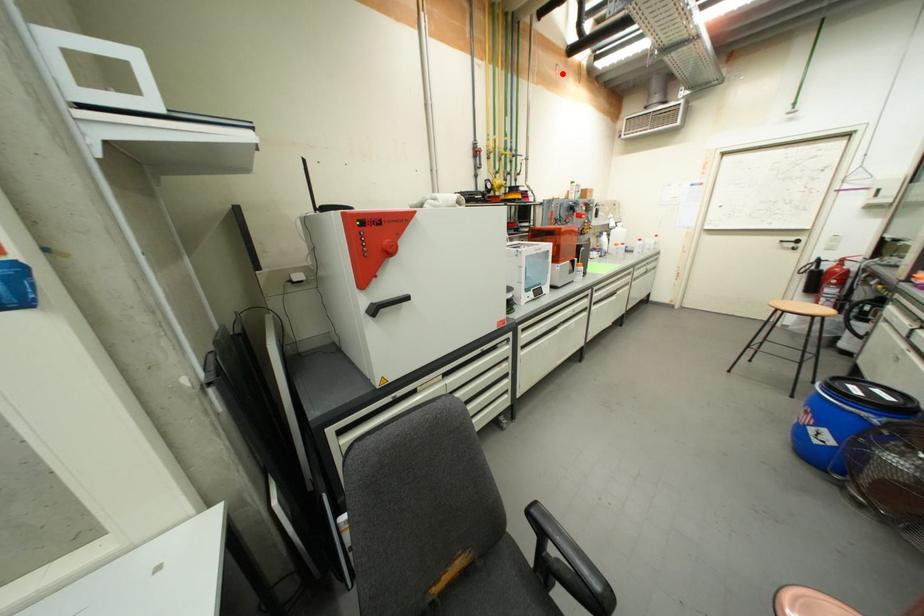
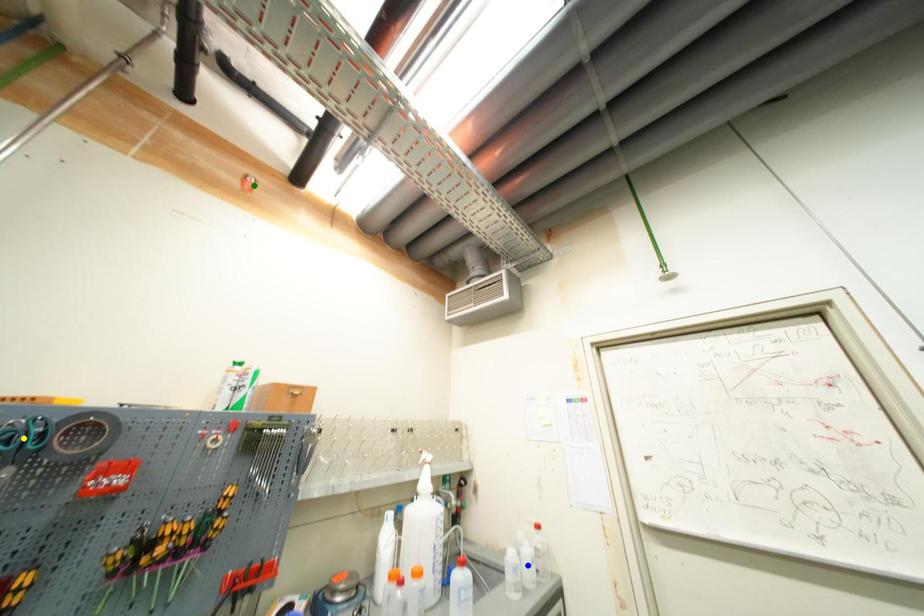
Question: I am providing you with two images of the same scene from different viewpoints. A red point is marked on the first image. You are given multiple points on the second image. Which point in image 2 represents the same 3d spot as the red point in image 1?

Choices:
 (A) green point
 (B) yellow point
 (C) blue point

Answer: (A)